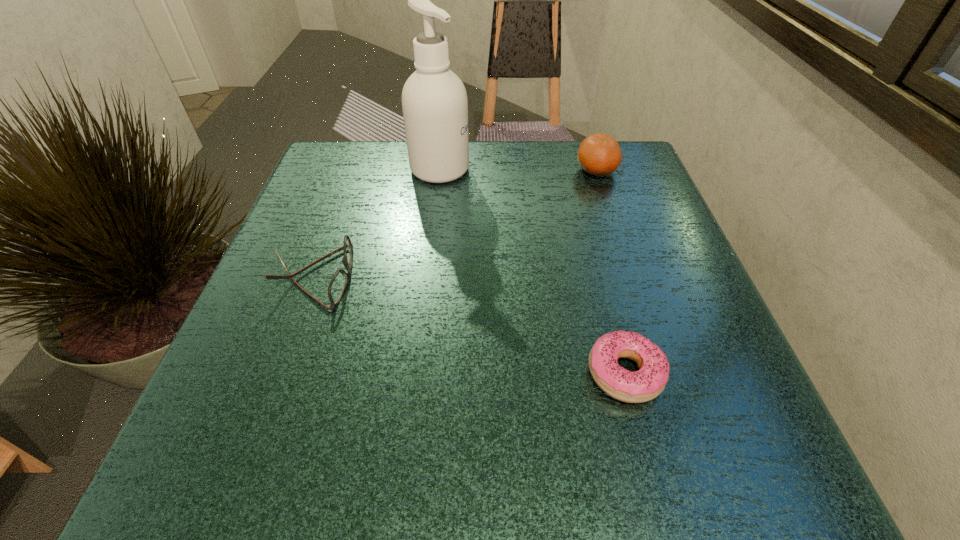
Identify the location of free point that satisfies the following two spatial constraints: 1. on the front label of the clementine; 2. on the right side of the third object from right to left. This screenshot has height=540, width=960. (440, 170).

Identify the location of free space that satisfies the following two spatial constraints: 1. on the front label of the third shortest object; 2. on the right side of the tallest object. (440, 170).